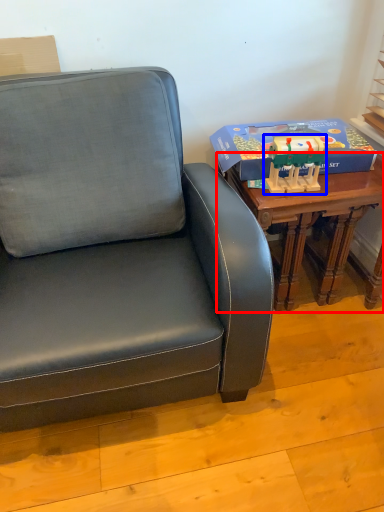
Question: Which point is further to the camera, table (highlighted by a red box) or toy (highlighted by a blue box)?

Choices:
 (A) table
 (B) toy

Answer: (A)